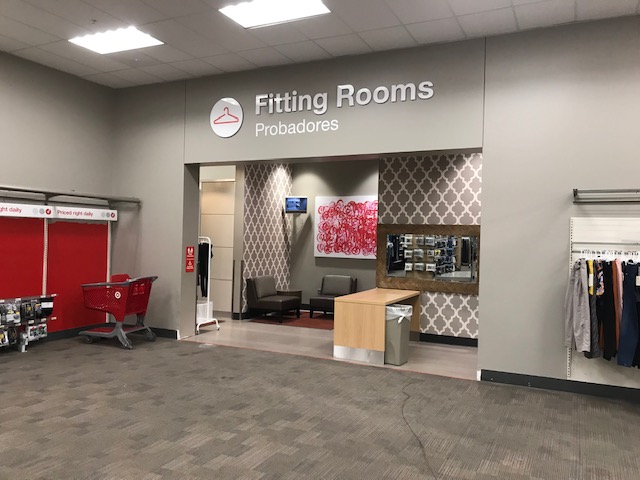
Where is `table`? Image resolution: width=640 pixels, height=480 pixels. table is located at coordinates (292, 290).